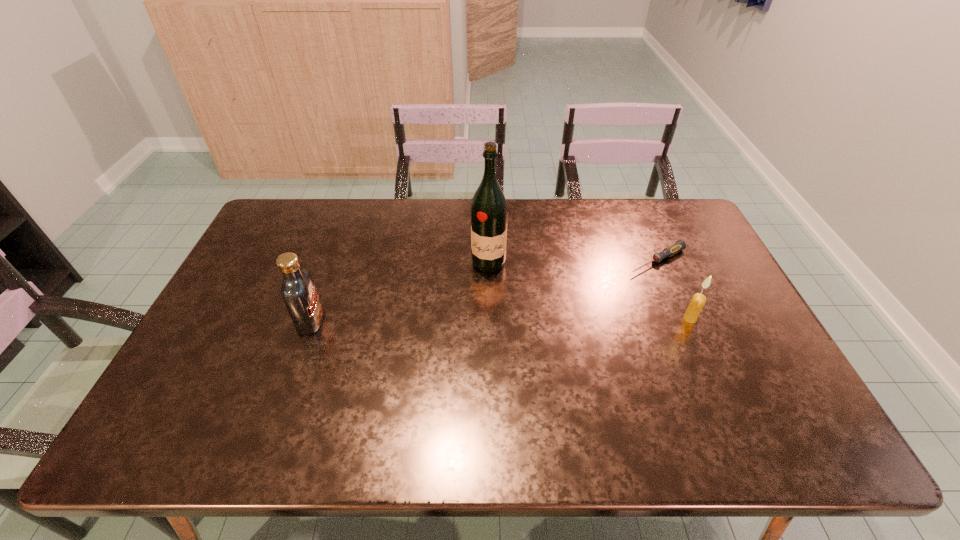
This screenshot has height=540, width=960. Find the location of `free space on the desktop that is between the leftmost object and the third tallest object and is positioned insert the screwdriver into a screw head`. free space on the desktop that is between the leftmost object and the third tallest object and is positioned insert the screwdriver into a screw head is located at coordinates (550, 320).

Locate an element on the screen. free spot on the desktop that is between the leftmost object and the candle and is positioned on the front-facing side of the tallest object is located at coordinates (473, 320).